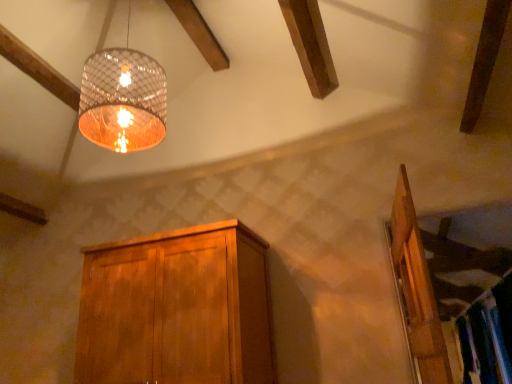
Question: Does wooden cabinet at center have a larger size compared to wooden door at right?

Choices:
 (A) yes
 (B) no

Answer: (A)

Question: Are wooden cabinet at center and wooden door at right beside each other?

Choices:
 (A) yes
 (B) no

Answer: (B)

Question: Are wooden cabinet at center and wooden door at right located far from each other?

Choices:
 (A) yes
 (B) no

Answer: (A)

Question: From a real-world perspective, does wooden cabinet at center sit lower than wooden door at right?

Choices:
 (A) no
 (B) yes

Answer: (A)

Question: Can you confirm if wooden cabinet at center is smaller than wooden door at right?

Choices:
 (A) no
 (B) yes

Answer: (A)

Question: From the image's perspective, is wooden cabinet at center above wooden door at right?

Choices:
 (A) no
 (B) yes

Answer: (A)

Question: Is translucent glass lampshade at upper center surrounding wooden door at right?

Choices:
 (A) yes
 (B) no

Answer: (B)

Question: From a real-world perspective, does translucent glass lampshade at upper center stand above wooden door at right?

Choices:
 (A) yes
 (B) no

Answer: (A)

Question: Is translucent glass lampshade at upper center located outside wooden door at right?

Choices:
 (A) no
 (B) yes

Answer: (B)

Question: Is translucent glass lampshade at upper center in front of wooden door at right?

Choices:
 (A) yes
 (B) no

Answer: (B)

Question: Is translucent glass lampshade at upper center bigger than wooden door at right?

Choices:
 (A) yes
 (B) no

Answer: (A)

Question: From the image's perspective, is translucent glass lampshade at upper center located above wooden door at right?

Choices:
 (A) yes
 (B) no

Answer: (A)

Question: Does wooden door at right come in front of translucent glass lampshade at upper center?

Choices:
 (A) no
 (B) yes

Answer: (B)